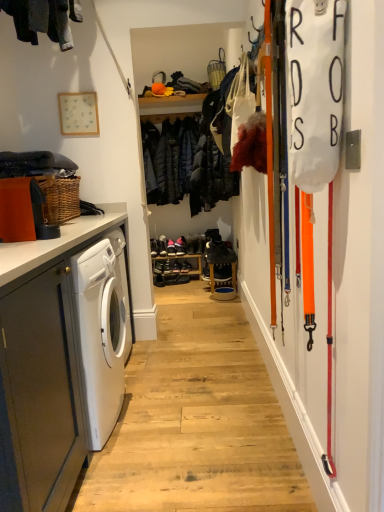
Question: Considering the relative positions of dark blue quilted jacket at center, positioned as the second clothing in front-to-back order, and matte gray cabinet at left in the image provided, is dark blue quilted jacket at center, positioned as the second clothing in front-to-back order, to the right of matte gray cabinet at left from the viewer's perspective?

Choices:
 (A) no
 (B) yes

Answer: (B)

Question: Considering the relative sizes of dark blue quilted jacket at center, the first clothing positioned from the back, and matte gray cabinet at left in the image provided, is dark blue quilted jacket at center, the first clothing positioned from the back, thinner than matte gray cabinet at left?

Choices:
 (A) no
 (B) yes

Answer: (B)

Question: From the image's perspective, would you say dark blue quilted jacket at center, the first clothing positioned from the back, is positioned over matte gray cabinet at left?

Choices:
 (A) no
 (B) yes

Answer: (B)

Question: Considering the relative sizes of dark blue quilted jacket at center, the first clothing positioned from the back, and matte gray cabinet at left in the image provided, is dark blue quilted jacket at center, the first clothing positioned from the back, wider than matte gray cabinet at left?

Choices:
 (A) yes
 (B) no

Answer: (B)

Question: Is dark blue quilted jacket at center, positioned as the second clothing in front-to-back order, at the left side of matte gray cabinet at left?

Choices:
 (A) yes
 (B) no

Answer: (B)

Question: Is dark blue quilted jacket at center, the first clothing positioned from the back, shorter than matte gray cabinet at left?

Choices:
 (A) no
 (B) yes

Answer: (A)

Question: From a real-world perspective, is dark gray fabric at left, the first clothing positioned from the front, physically below matte gray cabinet at left?

Choices:
 (A) no
 (B) yes

Answer: (A)

Question: Is dark gray fabric at left, acting as the second clothing starting from the right, with matte gray cabinet at left?

Choices:
 (A) no
 (B) yes

Answer: (A)

Question: Considering the relative positions of dark gray fabric at left, which is the 2th clothing in back-to-front order, and matte gray cabinet at left in the image provided, is dark gray fabric at left, which is the 2th clothing in back-to-front order, behind matte gray cabinet at left?

Choices:
 (A) no
 (B) yes

Answer: (B)

Question: Can you confirm if dark gray fabric at left, which ranks as the first clothing in left-to-right order, is thinner than matte gray cabinet at left?

Choices:
 (A) yes
 (B) no

Answer: (A)

Question: From the image's perspective, is dark gray fabric at left, which ranks as the first clothing in left-to-right order, under matte gray cabinet at left?

Choices:
 (A) no
 (B) yes

Answer: (A)

Question: Is dark gray fabric at left, which ranks as the first clothing in left-to-right order, closer to the viewer compared to matte gray cabinet at left?

Choices:
 (A) yes
 (B) no

Answer: (B)

Question: Is matte gray cabinet at left closer to camera compared to matte black basket at upper center?

Choices:
 (A) no
 (B) yes

Answer: (B)